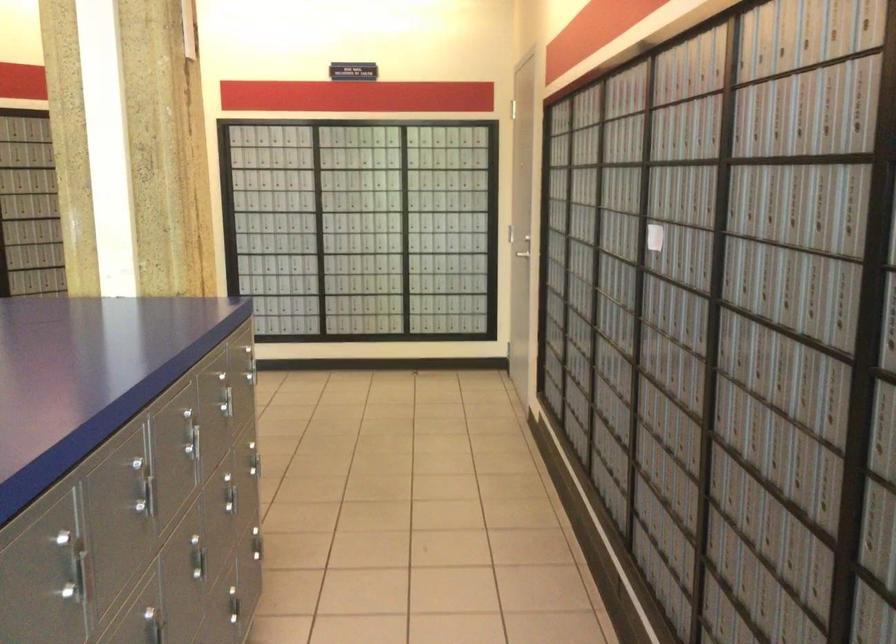
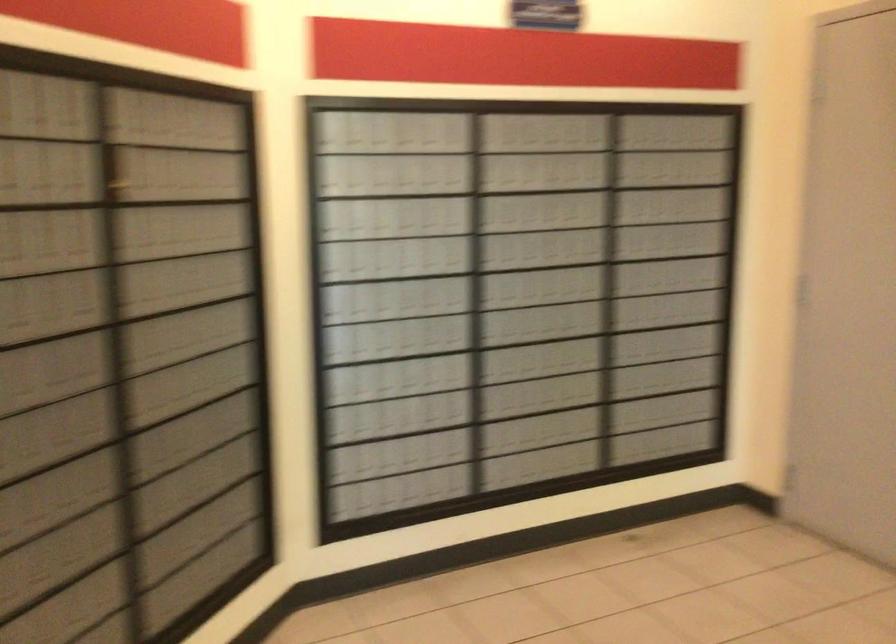
What movement of the cameraman would produce the second image?

The movement direction of the cameraman is left, forward.